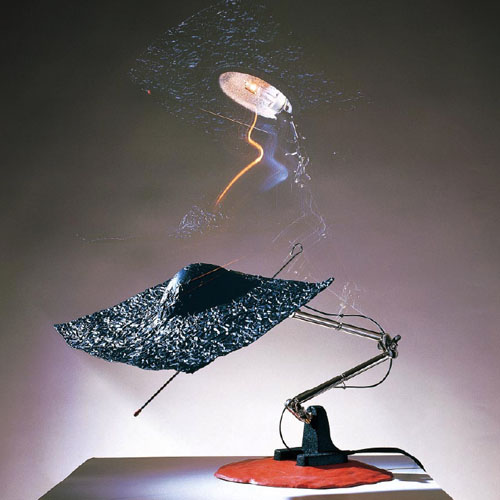
The height and width of the screenshot is (500, 500). What are the coordinates of `don quixote table lamp` in the screenshot? It's located at (319, 438).